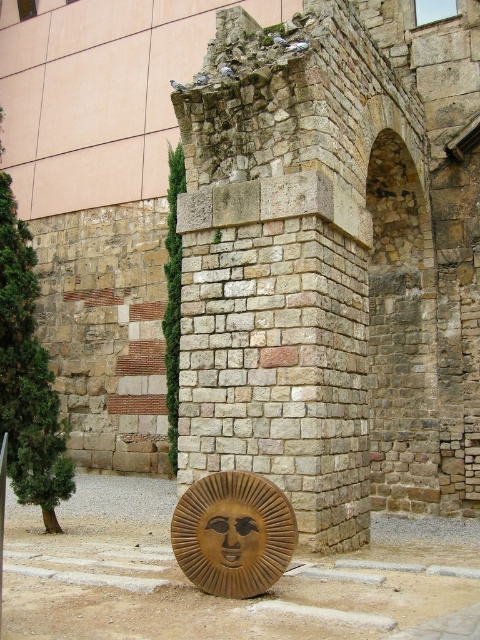
Question: Which point is farther to the camera?

Choices:
 (A) golden polished sun at lower center
 (B) wooden carved face at lower center

Answer: (B)

Question: Which point is farther to the camera?

Choices:
 (A) (203, 563)
 (B) (252, 544)

Answer: (A)

Question: Is golden polished sun at lower center above wooden carved face at lower center?

Choices:
 (A) no
 (B) yes

Answer: (A)

Question: Is golden polished sun at lower center to the right of wooden carved face at lower center from the viewer's perspective?

Choices:
 (A) yes
 (B) no

Answer: (A)

Question: Which of the following is the farthest from the observer?

Choices:
 (A) (207, 506)
 (B) (259, 536)

Answer: (A)

Question: Is golden polished sun at lower center bigger than wooden carved face at lower center?

Choices:
 (A) no
 (B) yes

Answer: (A)